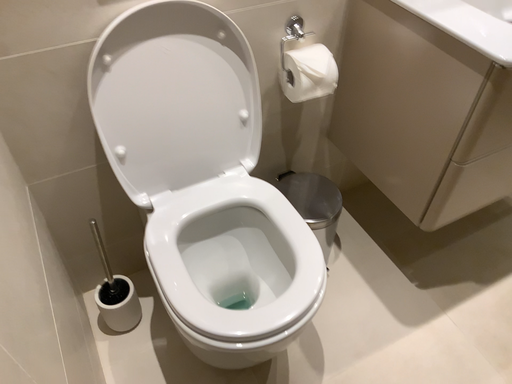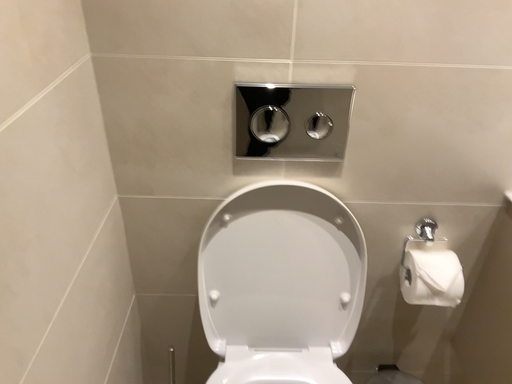
Question: Which way did the camera rotate in the video?

Choices:
 (A) rotated left
 (B) rotated right

Answer: (A)